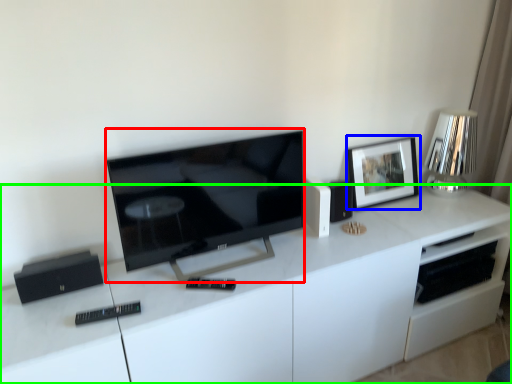
Question: Considering the real-world distances, which object is farthest from television (highlighted by a red box)? picture frame (highlighted by a blue box) or cabinetry (highlighted by a green box)?

Choices:
 (A) picture frame
 (B) cabinetry

Answer: (A)